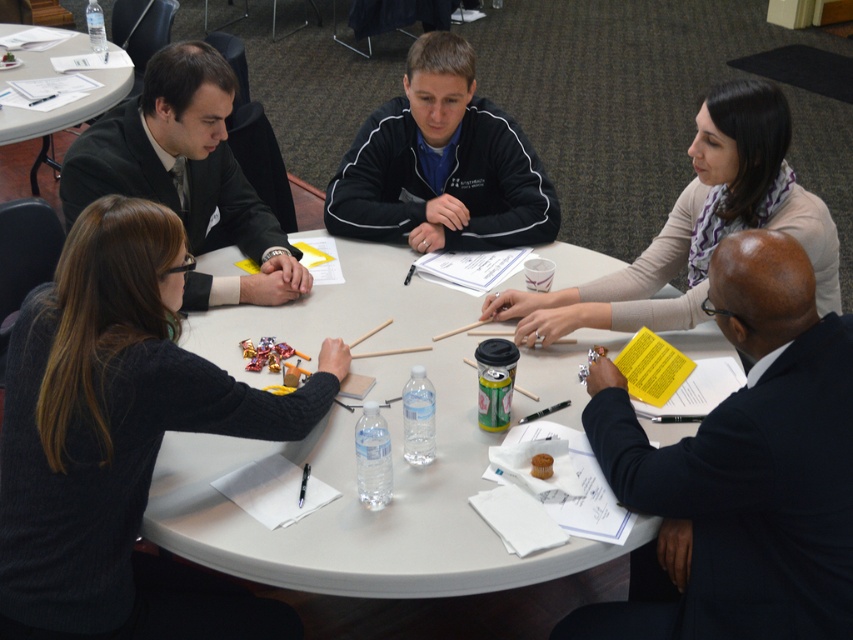
You are a photographer planning to take a group photo of the participants. You need to ensure that the light beige scarf at upper right and the matte black suit at upper left are both visible in the frame. Based on their positions, which object is closer to the right edge of the photo?

The light beige scarf at upper right is positioned on the right side of the matte black suit at upper left, so the light beige scarf at upper right is closer to the right edge of the photo.

You are a photographer positioned at the entrance of the room. You need to capture a photo that includes both the black suit at lower right and the white plastic table at upper left. Based on their positions, which object should you frame first in your camera viewfinder to ensure both are in the shot?

You should frame the white plastic table at upper left first because the black suit at lower right is to the right of it, so by starting with the table on the left side of the frame, you can adjust the camera angle to include both objects in the shot.

You are organizing a photo shoot and need to arrange two items for a fashion display. You have the black fleece jacket at center and the light beige scarf at upper right. Based on their current positions, which item is located to the left of the other?

The black fleece jacket at center is positioned on the left side of light beige scarf at upper right.